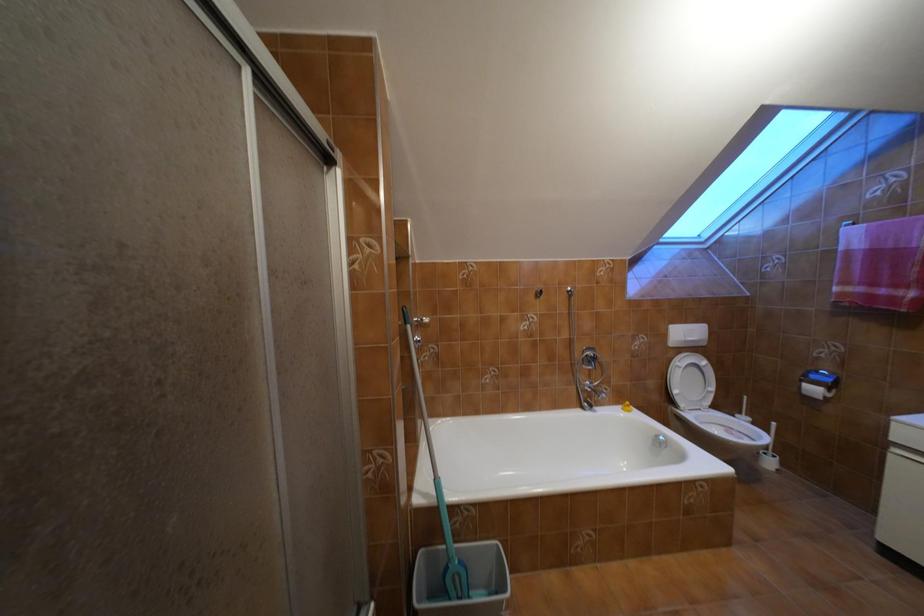
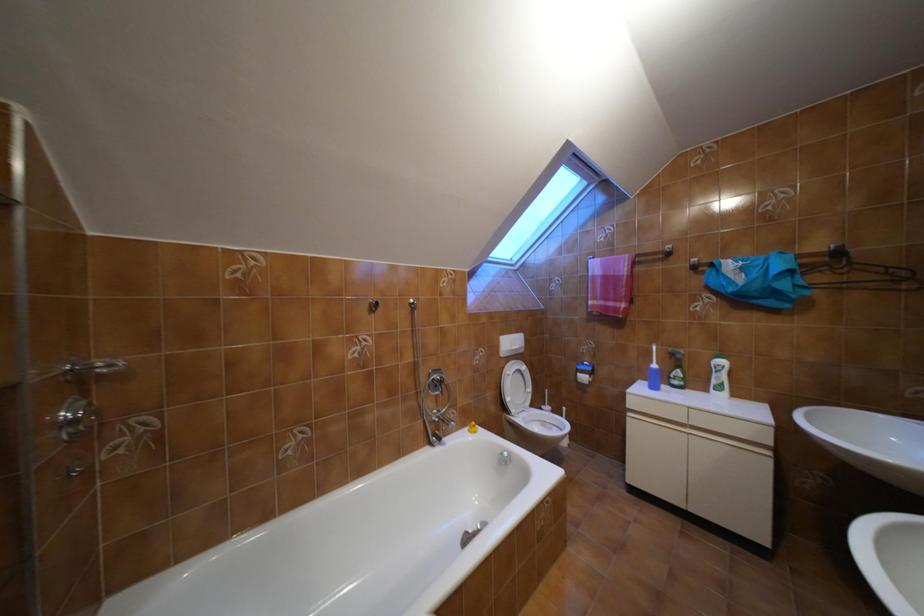
Question: The camera is either moving clockwise (left) or counter-clockwise (right) around the object. The first image is from the beginning of the video and the second image is from the end. Is the camera moving left or right when shooting the video?

Choices:
 (A) Left
 (B) Right

Answer: (A)